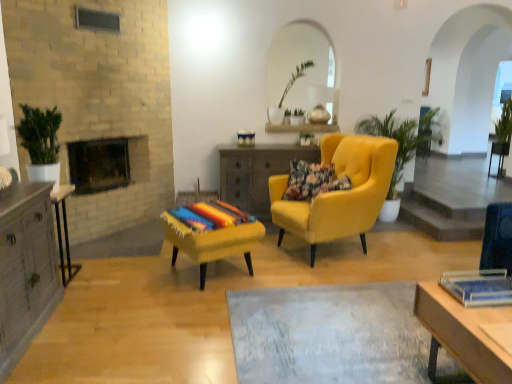
Question: From a real-world perspective, is wooden desk at lower right positioned under floral fabric pillow at center based on gravity?

Choices:
 (A) yes
 (B) no

Answer: (A)

Question: Is wooden desk at lower right to the left of floral fabric pillow at center from the viewer's perspective?

Choices:
 (A) yes
 (B) no

Answer: (B)

Question: Is wooden desk at lower right outside of floral fabric pillow at center?

Choices:
 (A) yes
 (B) no

Answer: (A)

Question: Does wooden desk at lower right have a lesser width compared to floral fabric pillow at center?

Choices:
 (A) no
 (B) yes

Answer: (A)

Question: Considering the relative sizes of wooden desk at lower right and floral fabric pillow at center in the image provided, is wooden desk at lower right bigger than floral fabric pillow at center?

Choices:
 (A) no
 (B) yes

Answer: (B)

Question: Is the position of wooden desk at lower right less distant than that of floral fabric pillow at center?

Choices:
 (A) no
 (B) yes

Answer: (B)

Question: Does floral fabric pillow at center appear on the left side of green leafy plant at center, which ranks as the first plant in bottom-to-top order?

Choices:
 (A) yes
 (B) no

Answer: (A)

Question: Is floral fabric pillow at center further to camera compared to green leafy plant at center, the second plant viewed from the right?

Choices:
 (A) no
 (B) yes

Answer: (A)

Question: Could you tell me if floral fabric pillow at center is turned towards green leafy plant at center, marked as the second plant in a top-to-bottom arrangement?

Choices:
 (A) no
 (B) yes

Answer: (A)

Question: From a real-world perspective, is floral fabric pillow at center on green leafy plant at center, positioned as the 1th plant in front-to-back order?

Choices:
 (A) yes
 (B) no

Answer: (B)

Question: Is floral fabric pillow at center thinner than green leafy plant at center, which is the 1th plant from left to right?

Choices:
 (A) yes
 (B) no

Answer: (B)

Question: Is floral fabric pillow at center far from green leafy plant at center, the second plant viewed from the right?

Choices:
 (A) yes
 (B) no

Answer: (A)

Question: Is wooden side table at center, the 1th table when ordered from back to front, outside of yellow fabric armchair at center?

Choices:
 (A) yes
 (B) no

Answer: (A)